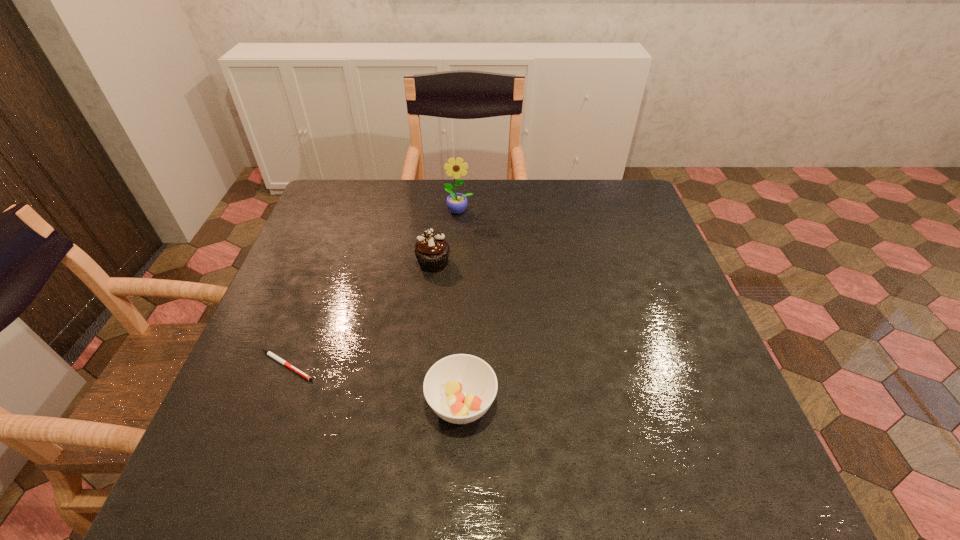
What are the coordinates of `free region located on the clicker of the leftmost object` in the screenshot? It's located at (485, 366).

You are a GUI agent. You are given a task and a screenshot of the screen. Output one action in this format:
    pyautogui.click(x=<x>, y=<y>)
    Task: Click on the object located in the far edge section of the desktop
    
    Given the screenshot: What is the action you would take?
    pyautogui.click(x=456, y=202)

Identify the location of object present at the left edge. (280, 360).

Locate an element on the screen. vacant space at the far edge of the desktop is located at coordinates (413, 209).

In order to click on vacant space at the near edge in this screenshot , I will do `click(529, 451)`.

Image resolution: width=960 pixels, height=540 pixels. In the image, there is a desktop. Find the location of `blank space at the left edge`. blank space at the left edge is located at coordinates (294, 338).

Where is `free space at the right edge`? The width and height of the screenshot is (960, 540). free space at the right edge is located at coordinates (653, 239).

Where is `vacant space at the far left corner of the desktop`? Image resolution: width=960 pixels, height=540 pixels. vacant space at the far left corner of the desktop is located at coordinates (364, 190).

In order to click on vacant space at the far right corner of the desktop in this screenshot , I will do `click(638, 199)`.

You are a GUI agent. You are given a task and a screenshot of the screen. Output one action in this format:
    pyautogui.click(x=<x>, y=<y>)
    Task: Click on the free space at the near right corner of the desktop
    
    Given the screenshot: What is the action you would take?
    pyautogui.click(x=733, y=458)